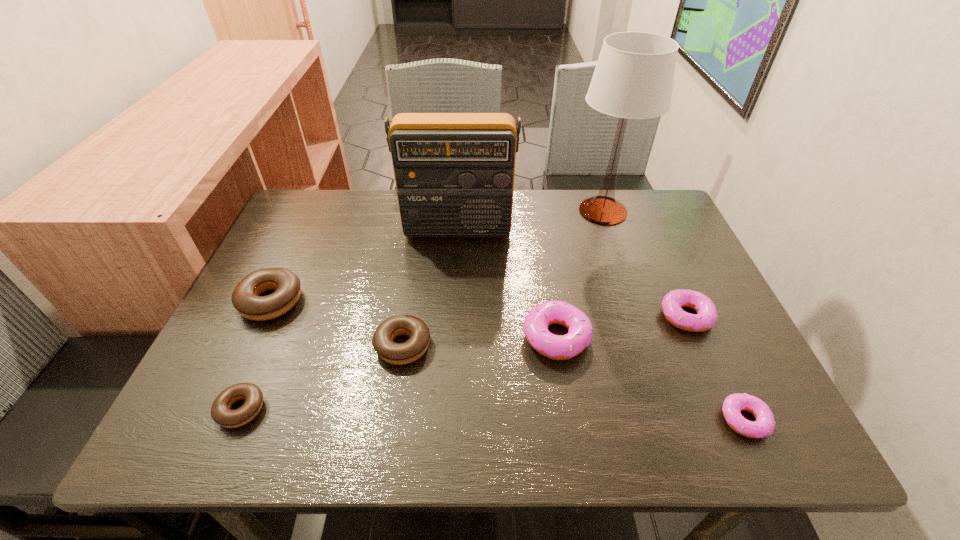
The width and height of the screenshot is (960, 540). Find the location of `pink doughnut that stands as the third closest to the tallest object`. pink doughnut that stands as the third closest to the tallest object is located at coordinates (764, 426).

Identify which pink doughnut is located as the second nearest to the rightmost brown doughnut. Please provide its 2D coordinates. Your answer should be formatted as a tuple, i.e. [(x, y)], where the tuple contains the x and y coordinates of a point satisfying the conditions above.

[(706, 316)]

Image resolution: width=960 pixels, height=540 pixels. What are the coordinates of `blank space that satisfies the following two spatial constraints: 1. on the back side of the second biggest pink doughnut; 2. on the right side of the biggest pink doughnut` in the screenshot? It's located at (553, 316).

In order to click on free space in the image that satisfies the following two spatial constraints: 1. on the front side of the second smallest pink doughnut; 2. on the left side of the biggest brown doughnut in this screenshot , I will do `click(265, 316)`.

Identify the location of vacant space that satisfies the following two spatial constraints: 1. above the cylindrical shade of the table lamp; 2. on the left side of the second biggest pink doughnut. (638, 316).

This screenshot has height=540, width=960. Identify the location of vacant space that satisfies the following two spatial constraints: 1. on the front side of the second smallest brown doughnut; 2. on the left side of the smallest pink doughnut. (392, 420).